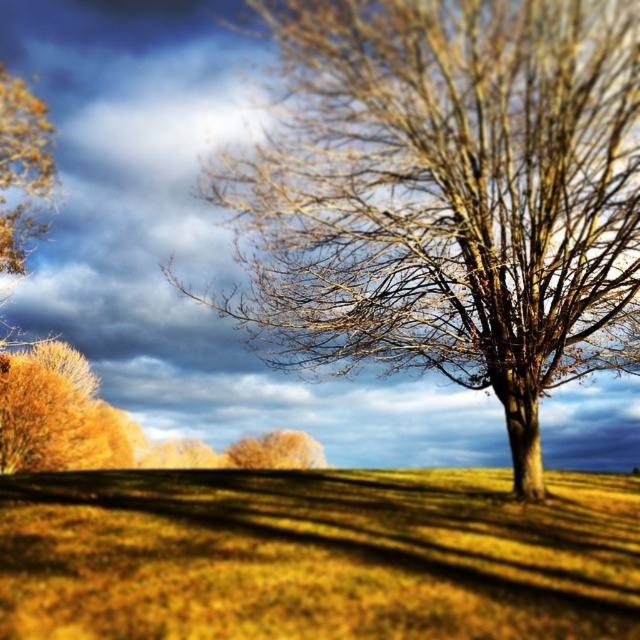
Question: Which point appears farthest from the camera in this image?

Choices:
 (A) click(323, 108)
 (B) click(282, 433)

Answer: (B)

Question: Can you confirm if yellow grassy field at center is positioned to the right of golden textured tree at center?

Choices:
 (A) no
 (B) yes

Answer: (B)

Question: Does yellow grassy field at center have a lesser width compared to golden textured tree at center?

Choices:
 (A) yes
 (B) no

Answer: (B)

Question: Which point appears closest to the camera in this image?

Choices:
 (A) (550, 93)
 (B) (33, 620)
 (C) (298, 444)

Answer: (B)

Question: Is the position of yellow grassy field at center more distant than that of golden textured tree at center?

Choices:
 (A) yes
 (B) no

Answer: (B)

Question: Which point is farther to the camera?

Choices:
 (A) golden textured tree at center
 (B) yellow grassy field at center

Answer: (A)